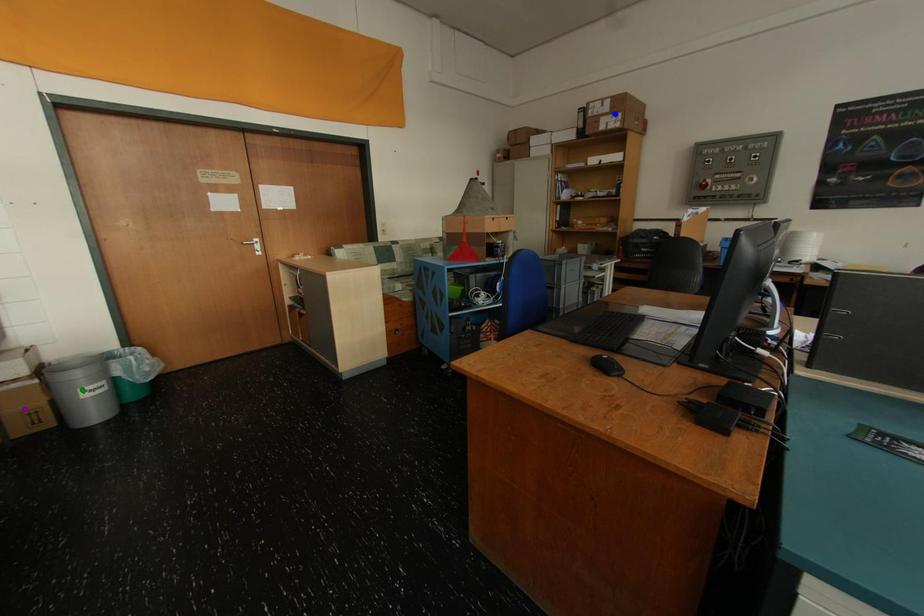
Order these from nearest to farthest:
1. blue point
2. purple point
3. green point

blue point
green point
purple point